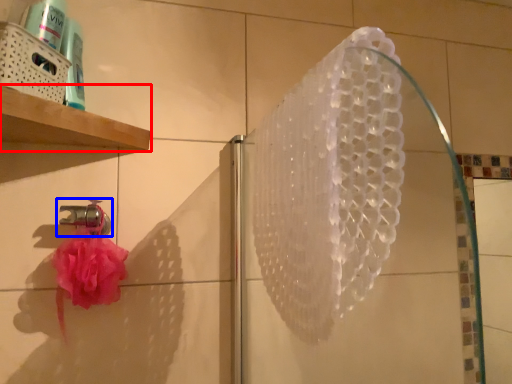
Question: Among these objects, which one is farthest to the camera, shelf (highlighted by a red box) or tap (highlighted by a blue box)?

Choices:
 (A) shelf
 (B) tap

Answer: (B)